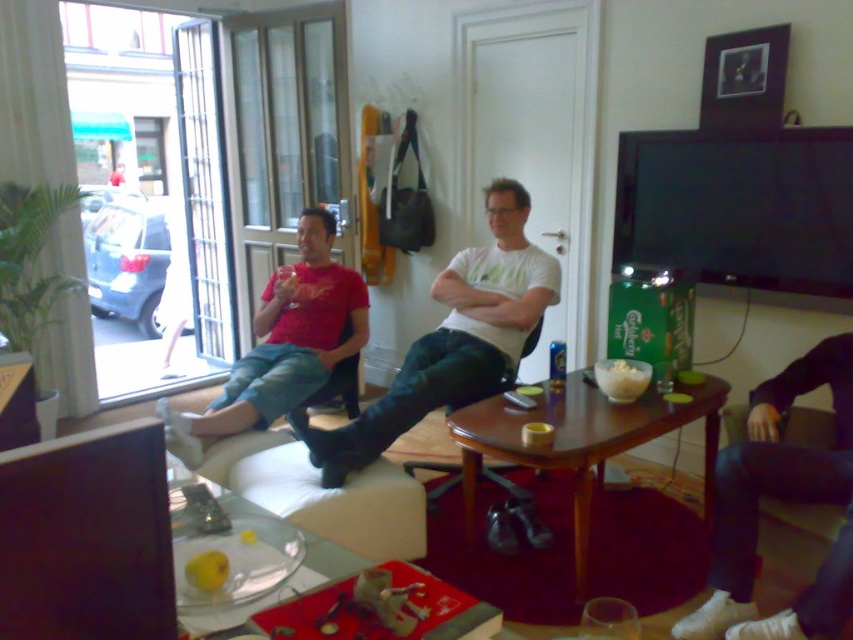
Can you confirm if brown wooden table at center is taller than white fabric couch at lower center?

Yes, brown wooden table at center is taller than white fabric couch at lower center.

Can you confirm if brown wooden table at center is positioned to the left of white fabric couch at lower center?

Incorrect, brown wooden table at center is not on the left side of white fabric couch at lower center.

Is point (506, 451) in front of point (317, 499)?

No, (506, 451) is behind (317, 499).

Where is `brown wooden table at center`? This screenshot has height=640, width=853. brown wooden table at center is located at coordinates (579, 442).

Who is more forward, (651, 417) or (428, 468)?

Point (651, 417)

Can you confirm if brown wooden table at center is smaller than leather armchair at center?

No, brown wooden table at center is not smaller than leather armchair at center.

The height and width of the screenshot is (640, 853). What do you see at coordinates (579, 442) in the screenshot? I see `brown wooden table at center` at bounding box center [579, 442].

Image resolution: width=853 pixels, height=640 pixels. Identify the location of brown wooden table at center. (579, 442).

Is matte red shirt at left shorter than leather armchair at center?

Incorrect, matte red shirt at left's height does not fall short of leather armchair at center's.

The image size is (853, 640). In order to click on matte red shirt at left in this screenshot , I will do `click(282, 344)`.